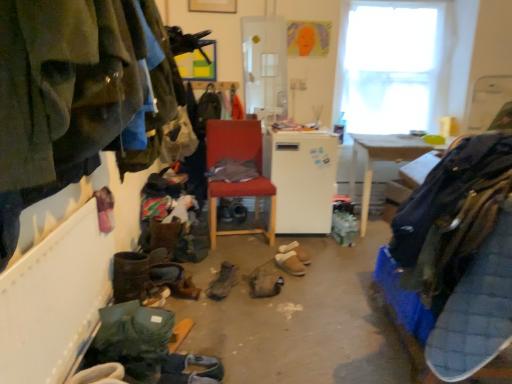
Question: Should I look upward or downward to see white matte refrigerator at center?

Choices:
 (A) up
 (B) down

Answer: (A)

Question: Is dark blue fabric at right, placed as the second clothing when sorted from left to right, oriented towards green suede jacket at left, the first clothing from the left?

Choices:
 (A) yes
 (B) no

Answer: (B)

Question: Can we say dark blue fabric at right, which appears as the first clothing when viewed from the right, lies outside green suede jacket at left, which is the 2th clothing in right-to-left order?

Choices:
 (A) no
 (B) yes

Answer: (B)

Question: From the image's perspective, is dark blue fabric at right, which appears as the first clothing when viewed from the right, above green suede jacket at left, which is the 2th clothing in right-to-left order?

Choices:
 (A) no
 (B) yes

Answer: (A)

Question: Considering the relative sizes of dark blue fabric at right, placed as the second clothing when sorted from left to right, and green suede jacket at left, the first clothing from the left, in the image provided, is dark blue fabric at right, placed as the second clothing when sorted from left to right, smaller than green suede jacket at left, the first clothing from the left,?

Choices:
 (A) yes
 (B) no

Answer: (B)

Question: Does dark blue fabric at right, which appears as the first clothing when viewed from the right, appear on the left side of green suede jacket at left, the first clothing from the left?

Choices:
 (A) yes
 (B) no

Answer: (B)

Question: Is dark blue fabric at right, which appears as the first clothing when viewed from the right, far from green suede jacket at left, which is the 2th clothing in right-to-left order?

Choices:
 (A) yes
 (B) no

Answer: (A)

Question: Can you confirm if dark blue fabric at right, which appears as the first clothing when viewed from the right, is smaller than wooden table at right?

Choices:
 (A) yes
 (B) no

Answer: (A)

Question: From the image's perspective, is dark blue fabric at right, which appears as the first clothing when viewed from the right, beneath wooden table at right?

Choices:
 (A) yes
 (B) no

Answer: (A)

Question: From the image's perspective, is dark blue fabric at right, placed as the second clothing when sorted from left to right, above wooden table at right?

Choices:
 (A) no
 (B) yes

Answer: (A)

Question: From a real-world perspective, is dark blue fabric at right, which appears as the first clothing when viewed from the right, located beneath wooden table at right?

Choices:
 (A) no
 (B) yes

Answer: (A)

Question: Considering the relative sizes of dark blue fabric at right, placed as the second clothing when sorted from left to right, and wooden table at right in the image provided, is dark blue fabric at right, placed as the second clothing when sorted from left to right, taller than wooden table at right?

Choices:
 (A) no
 (B) yes

Answer: (A)

Question: Is dark blue fabric at right, which appears as the first clothing when viewed from the right, located outside wooden table at right?

Choices:
 (A) no
 (B) yes

Answer: (B)

Question: Is brown suede sandals at center, the first footwear in the back-to-front sequence, shorter than matte red chair at center?

Choices:
 (A) no
 (B) yes

Answer: (B)